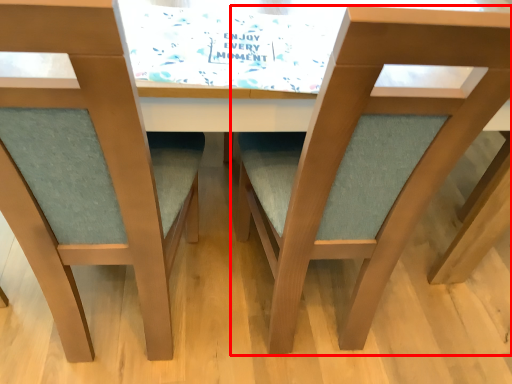
Question: Observing the image, what is the correct spatial positioning of chair (annotated by the red box) in reference to chair?

Choices:
 (A) left
 (B) right

Answer: (B)